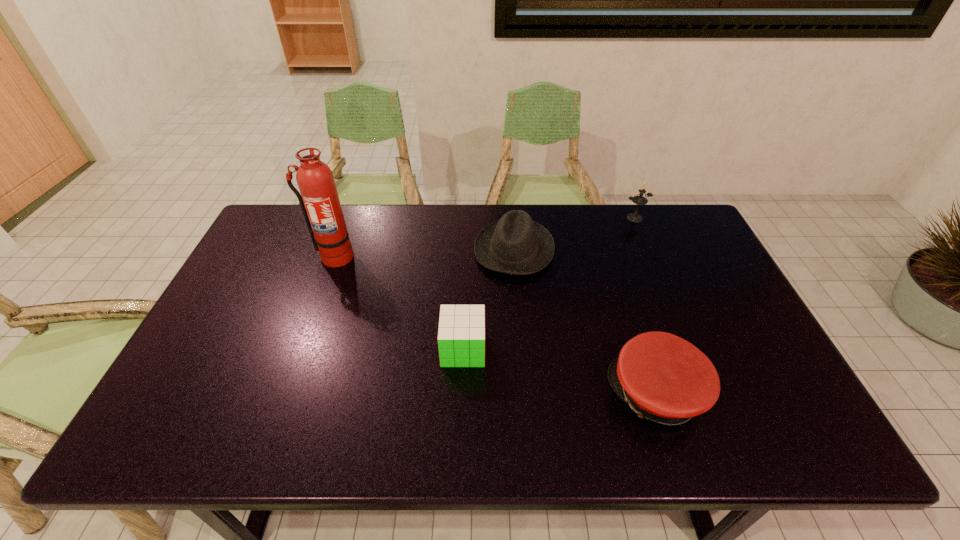
The width and height of the screenshot is (960, 540). Find the location of `vacant point at the far edge`. vacant point at the far edge is located at coordinates (491, 222).

This screenshot has height=540, width=960. Identify the location of vacant space at the near edge of the desktop. (610, 440).

In the image, there is a desktop. At what (x,y) coordinates should I click in order to perform the action: click on vacant space at the left edge. Please return your answer as a coordinate pair (x, y). This screenshot has height=540, width=960. Looking at the image, I should click on (188, 393).

The height and width of the screenshot is (540, 960). I want to click on free point at the right edge, so click(x=693, y=261).

The height and width of the screenshot is (540, 960). In order to click on free spot at the near left corner of the desktop in this screenshot , I will do `click(148, 446)`.

You are a GUI agent. You are given a task and a screenshot of the screen. Output one action in this format:
    pyautogui.click(x=<x>, y=<y>)
    Task: Click on the free space at the near right corner of the desktop
    The width and height of the screenshot is (960, 540).
    Given the screenshot: What is the action you would take?
    pyautogui.click(x=811, y=442)

Find the location of `free spot between the fedora and the cap`. free spot between the fedora and the cap is located at coordinates (586, 321).

You are a GUI agent. You are given a task and a screenshot of the screen. Output one action in this format:
    pyautogui.click(x=<x>, y=<y>)
    Task: Click on the free space between the cap and the tallest object
    This screenshot has height=540, width=960.
    Given the screenshot: What is the action you would take?
    pyautogui.click(x=495, y=325)

Locate an element on the screen. Image resolution: width=960 pixels, height=540 pixels. vacant area that lies between the tallest object and the cap is located at coordinates (495, 325).

Identify the location of free space between the candle holder and the cap. (646, 306).